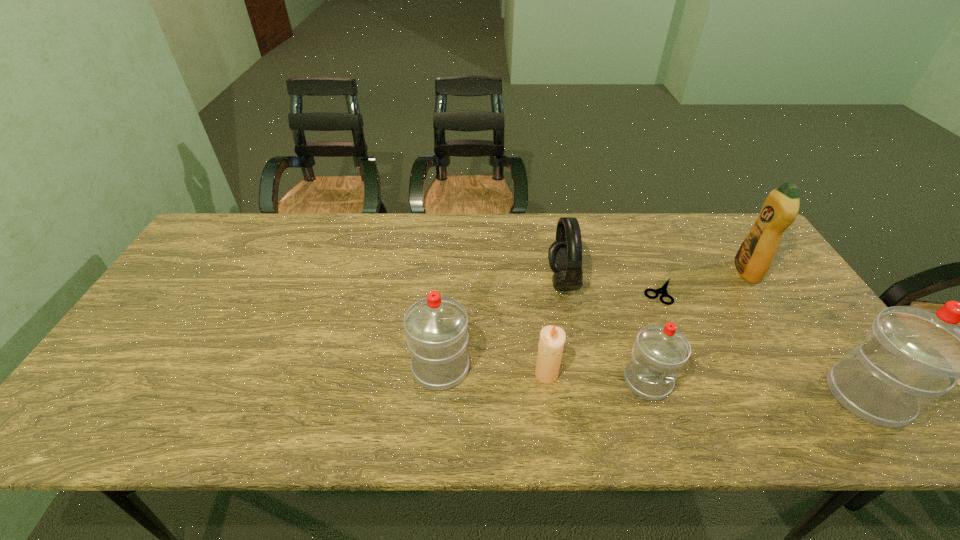
Image resolution: width=960 pixels, height=540 pixels. I want to click on the fifth shortest object, so click(436, 326).

Identify the location of the second shortest water bottle. (436, 326).

Where is `the shortest water bottle`? the shortest water bottle is located at coordinates (660, 351).

In order to click on the second water bottle from right to left in this screenshot , I will do `click(660, 351)`.

This screenshot has width=960, height=540. Identify the location of the rightmost water bottle. coord(912,355).

Find the location of `the fifth object from right to left`. the fifth object from right to left is located at coordinates (565, 254).

This screenshot has width=960, height=540. I want to click on detergent, so click(753, 259).

Find the location of a particular element. The height and width of the screenshot is (540, 960). the shortest object is located at coordinates (663, 290).

Locate an element on the screen. This screenshot has width=960, height=540. the fifth object from left to right is located at coordinates (663, 290).

Where is `candle`? candle is located at coordinates (552, 338).